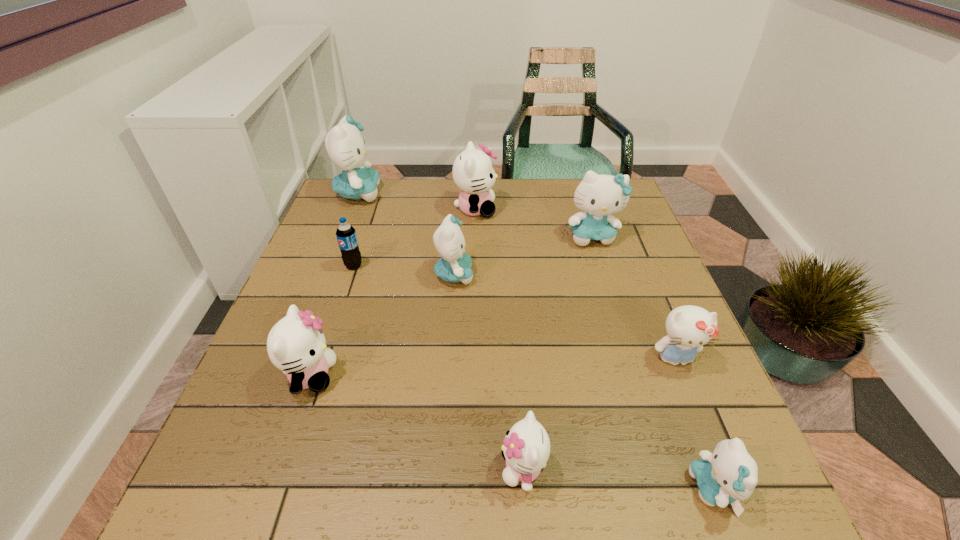
I want to click on the tallest object, so click(x=346, y=148).

The image size is (960, 540). What are the coordinates of `the leftmost blue kitten` in the screenshot? It's located at (346, 148).

Locate an element on the screen. the biggest white kitten is located at coordinates (473, 173).

The width and height of the screenshot is (960, 540). I want to click on the third smallest blue kitten, so click(x=598, y=195).

The width and height of the screenshot is (960, 540). What are the coordinates of `the second blue kitten from left to right` in the screenshot? It's located at (454, 266).

Identify the location of the second smallest blue kitten. The height and width of the screenshot is (540, 960). (454, 266).

Where is `the leftmost white kitten`? Image resolution: width=960 pixels, height=540 pixels. the leftmost white kitten is located at coordinates (296, 344).

This screenshot has height=540, width=960. Identify the location of the second farthest white kitten. (296, 344).

Image resolution: width=960 pixels, height=540 pixels. I want to click on soda bottle, so click(x=346, y=235).

You are a GUI agent. You are given a task and a screenshot of the screen. Output one action in this format:
    pyautogui.click(x=<x>, y=<y>)
    Task: Click on the nearest white kitten
    The height and width of the screenshot is (540, 960).
    Given the screenshot: What is the action you would take?
    pyautogui.click(x=526, y=448)